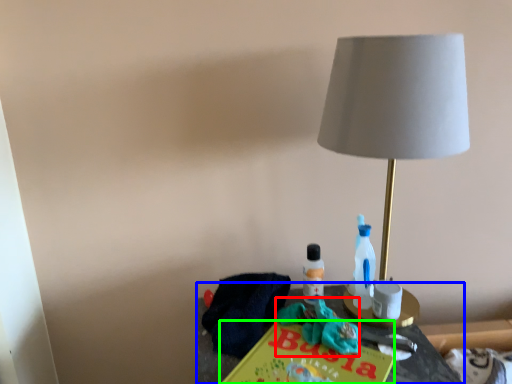
Question: Which is farther away from scrub (highlighted by a red box)? table (highlighted by a blue box) or paperback book (highlighted by a green box)?

Choices:
 (A) table
 (B) paperback book

Answer: (A)